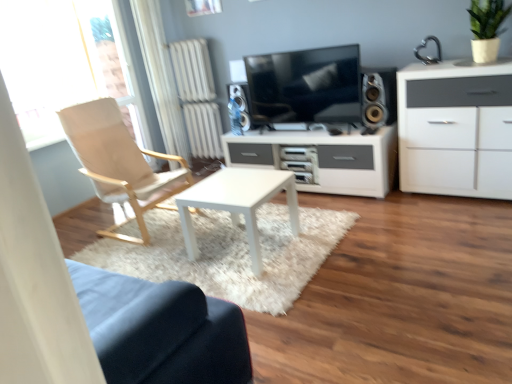
Identify the location of vacant space in front of white matte coffee table at center. (257, 278).